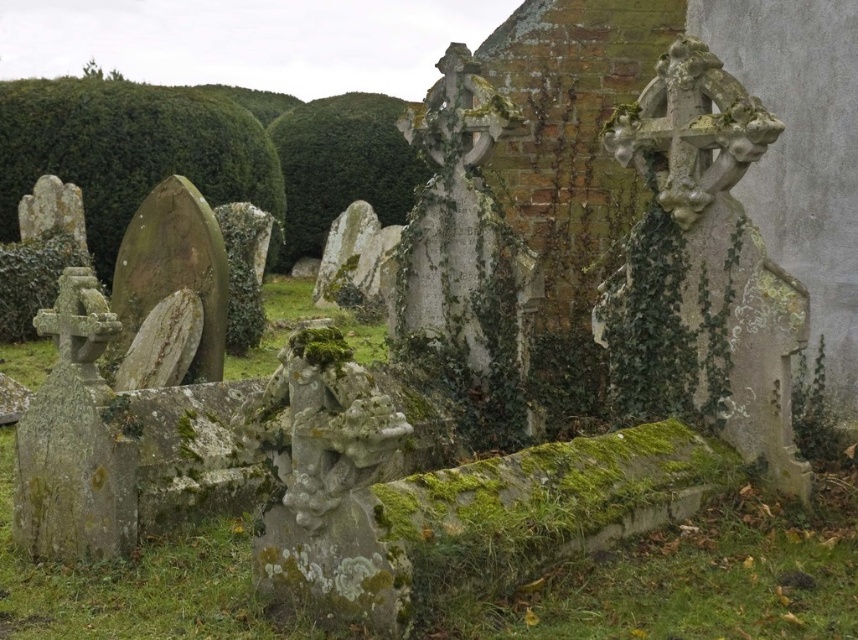
You are standing at the entrance of the cemetery and notice two hedges in the background. The green mossy hedge at upper left and the green leafy hedge at upper center. Which hedge is closer to you?

The green mossy hedge at upper left is closer to you because it is in front of the green leafy hedge at upper center.

You are standing in the cemetery looking towards the gravestones. Which hedge, the green mossy hedge at upper left or the green leafy hedge at upper center, is positioned more to the left side of the cemetery?

The green mossy hedge at upper left is positioned more to the left side of the cemetery than the green leafy hedge at upper center.